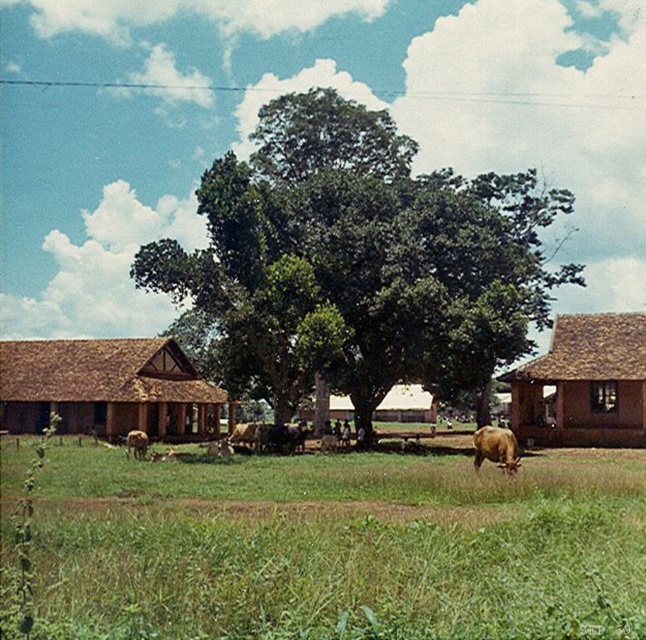
Question: Is green leafy tree at center above brown textured cow at center?

Choices:
 (A) no
 (B) yes

Answer: (B)

Question: Which point is farther from the camera taking this photo?

Choices:
 (A) (x=592, y=422)
 (B) (x=309, y=365)
 (C) (x=481, y=445)
 (D) (x=123, y=403)

Answer: (D)

Question: Which point appears closest to the camera in this image?

Choices:
 (A) (510, 452)
 (B) (213, 452)
 (C) (601, 397)
 (D) (517, 614)

Answer: (D)

Question: Does brown thatched roof hut at left appear over brown matte cow at lower right?

Choices:
 (A) no
 (B) yes

Answer: (B)

Question: Can you confirm if green grass at center is bigger than green leafy tree at center?

Choices:
 (A) no
 (B) yes

Answer: (A)

Question: Which of the following is the farthest from the observer?

Choices:
 (A) brown thatched roof hut at right
 (B) green grass at center
 (C) brown thatched roof hut at left
 (D) brown textured cow at center

Answer: (C)